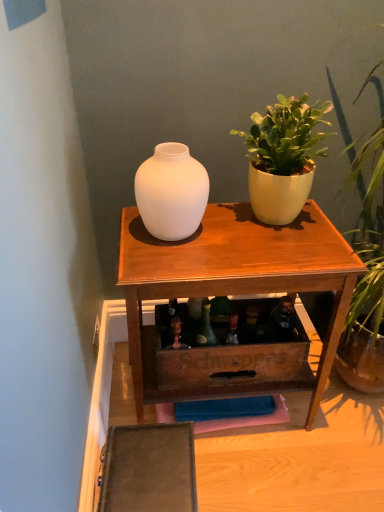
You are a GUI agent. You are given a task and a screenshot of the screen. Output one action in this format:
    pyautogui.click(x=<x>, y=<y>)
    Task: Click on the free point below matte yellow pot at upper right (from a real-world perspective)
    
    Given the screenshot: What is the action you would take?
    pyautogui.click(x=262, y=223)